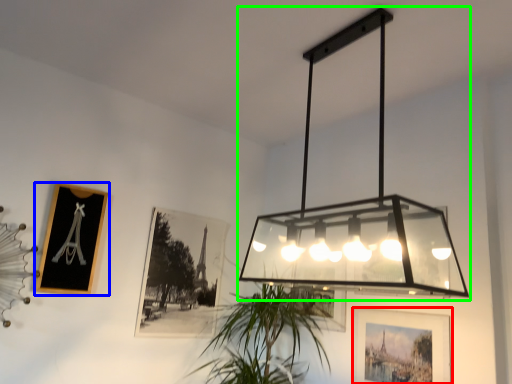
Question: Which is nearer to the picture frame (highlighted by a red box)? picture frame (highlighted by a blue box) or lamp (highlighted by a green box).

Choices:
 (A) picture frame
 (B) lamp

Answer: (B)